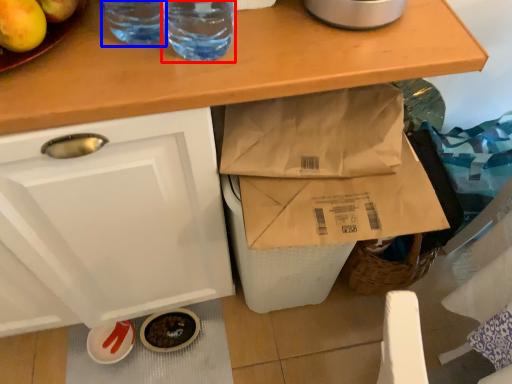
Question: Among these objects, which one is nearest to the camera, drinking straw (highlighted by a red box) or drinking straw (highlighted by a blue box)?

Choices:
 (A) drinking straw
 (B) drinking straw

Answer: (A)